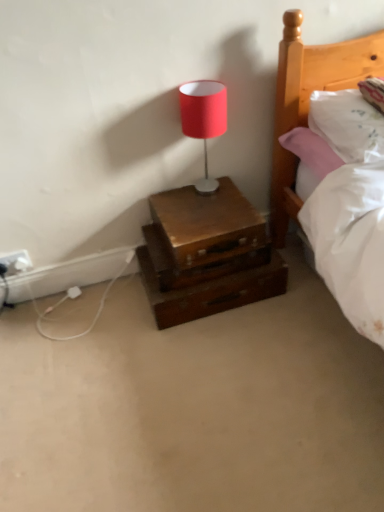
The height and width of the screenshot is (512, 384). I want to click on vacant area to the left of matte red lampshade at upper center, so click(169, 200).